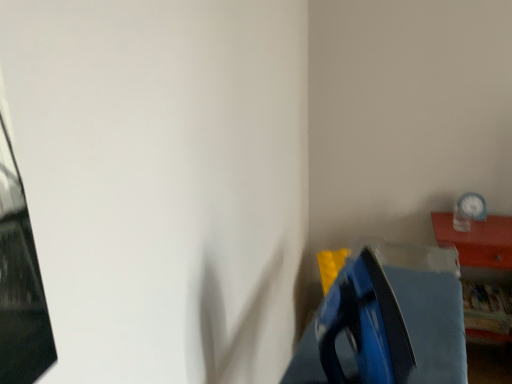
Where is `wooden clock at upper right`? Image resolution: width=512 pixels, height=384 pixels. wooden clock at upper right is located at coordinates (480, 250).

Image resolution: width=512 pixels, height=384 pixels. What do you see at coordinates (480, 250) in the screenshot? I see `wooden clock at upper right` at bounding box center [480, 250].

What is the approximate height of wooden clock at upper right?

The height of wooden clock at upper right is 27.25 inches.

Describe the element at coordinates (472, 206) in the screenshot. This screenshot has height=384, width=512. I see `white plastic clock at upper right` at that location.

This screenshot has width=512, height=384. Identify the location of white plastic clock at upper right. (472, 206).

Locate an element on the screen. wooden clock at upper right is located at coordinates (480, 250).

Which is more to the left, white plastic clock at upper right or wooden clock at upper right?

white plastic clock at upper right is more to the left.

Does white plastic clock at upper right lie in front of wooden clock at upper right?

No, white plastic clock at upper right is further to the viewer.

Considering the points (456, 204) and (511, 264), which point is in front, point (456, 204) or point (511, 264)?

The point (511, 264) is closer.

From the image's perspective, which is above, white plastic clock at upper right or wooden clock at upper right?

white plastic clock at upper right.

From a real-world perspective, is white plastic clock at upper right beneath wooden clock at upper right?

No, from a real-world perspective, white plastic clock at upper right is not beneath wooden clock at upper right.

Is white plastic clock at upper right wider or thinner than wooden clock at upper right?

In the image, white plastic clock at upper right appears to be more narrow than wooden clock at upper right.

Considering the sizes of objects white plastic clock at upper right and wooden clock at upper right in the image provided, who is taller, white plastic clock at upper right or wooden clock at upper right?

With more height is wooden clock at upper right.

Is white plastic clock at upper right smaller than wooden clock at upper right?

Correct, white plastic clock at upper right occupies less space than wooden clock at upper right.

Is wooden clock at upper right surrounded by white plastic clock at upper right?

Actually, wooden clock at upper right is outside white plastic clock at upper right.

Is white plastic clock at upper right directly adjacent to wooden clock at upper right?

No, white plastic clock at upper right is not next to wooden clock at upper right.

Is white plastic clock at upper right oriented away from wooden clock at upper right?

No, white plastic clock at upper right's orientation is not away from wooden clock at upper right.

How different are the orientations of white plastic clock at upper right and wooden clock at upper right in degrees?

They differ by 0.000269 degrees in their facing directions.

Locate an element on the screen. This screenshot has height=384, width=512. furniture located on the right of white plastic clock at upper right is located at coordinates (480, 250).

Considering the relative positions of wooden clock at upper right and white plastic clock at upper right in the image provided, is wooden clock at upper right to the left or to the right of white plastic clock at upper right?

Clearly, wooden clock at upper right is on the right of white plastic clock at upper right in the image.

Is wooden clock at upper right positioned in front of white plastic clock at upper right?

Yes, it is in front of white plastic clock at upper right.

Which is more distant, (460,245) or (468,207)?

The point (468,207) is farther from the camera.

From the image's perspective, which is below, wooden clock at upper right or white plastic clock at upper right?

wooden clock at upper right appears lower in the image.

From a real-world perspective, between wooden clock at upper right and white plastic clock at upper right, who is vertically higher?

white plastic clock at upper right.

In the scene shown: Does wooden clock at upper right have a greater width compared to white plastic clock at upper right?

Yes, wooden clock at upper right is wider than white plastic clock at upper right.

In terms of height, does wooden clock at upper right look taller or shorter compared to white plastic clock at upper right?

Considering their sizes, wooden clock at upper right has more height than white plastic clock at upper right.

Looking at this image, can you confirm if wooden clock at upper right is bigger than white plastic clock at upper right?

Correct, wooden clock at upper right is larger in size than white plastic clock at upper right.

Could white plastic clock at upper right be considered to be inside wooden clock at upper right?

That's incorrect, white plastic clock at upper right is not inside wooden clock at upper right.

Is there a large distance between wooden clock at upper right and white plastic clock at upper right?

That's not correct — wooden clock at upper right is a little close to white plastic clock at upper right.

Is wooden clock at upper right looking in the opposite direction of white plastic clock at upper right?

wooden clock at upper right does not have its back to white plastic clock at upper right.

What's the angular difference between wooden clock at upper right and white plastic clock at upper right's facing directions?

The angle between the facing direction of wooden clock at upper right and the facing direction of white plastic clock at upper right is 0.000269 degrees.

How much distance is there between wooden clock at upper right and white plastic clock at upper right?

A distance of 26.16 centimeters exists between wooden clock at upper right and white plastic clock at upper right.

Find the location of a particular element. This screenshot has width=512, height=384. clock above the wooden clock at upper right (from the image's perspective) is located at coordinates (472, 206).

Identify the location of furniture on the right side of white plastic clock at upper right. (480, 250).

At what (x,y) coordinates should I click in order to perform the action: click on clock behind the wooden clock at upper right. Please return your answer as a coordinate pair (x, y). Looking at the image, I should click on (472, 206).